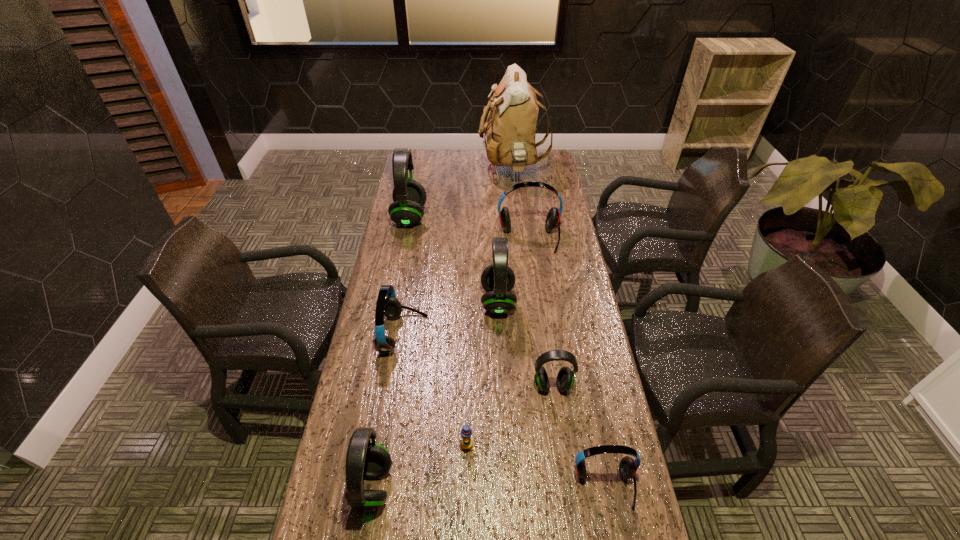
Locate an element on the screen. The width and height of the screenshot is (960, 540). brown backpack is located at coordinates (510, 130).

Where is `the farthest object`? the farthest object is located at coordinates (510, 130).

Identify the location of the second tallest object. (409, 196).

Identify the location of the farthest black headset. The width and height of the screenshot is (960, 540). (409, 196).

The height and width of the screenshot is (540, 960). I want to click on the third smallest black headset, so (498, 279).

I want to click on the third black headset from left to right, so click(x=498, y=279).

At what (x,y) coordinates should I click in order to perform the action: click on the farthest red headset. Please return your answer as a coordinate pair (x, y). Looking at the image, I should click on (552, 222).

The width and height of the screenshot is (960, 540). I want to click on the nearest black headset, so click(364, 459).

Where is `the second smallest red headset`? The image size is (960, 540). the second smallest red headset is located at coordinates (390, 307).

Where is `the second farthest red headset`? the second farthest red headset is located at coordinates (390, 307).